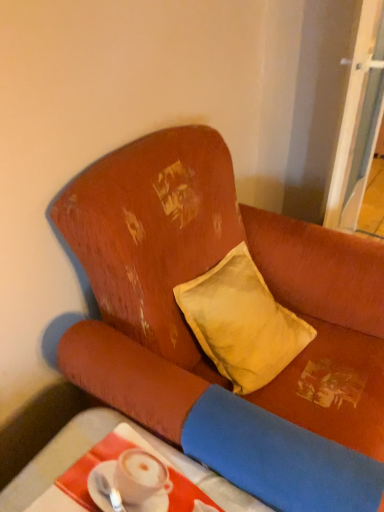
Where is `blank space to the left of white glossy spoon at lower left`? blank space to the left of white glossy spoon at lower left is located at coordinates (61, 486).